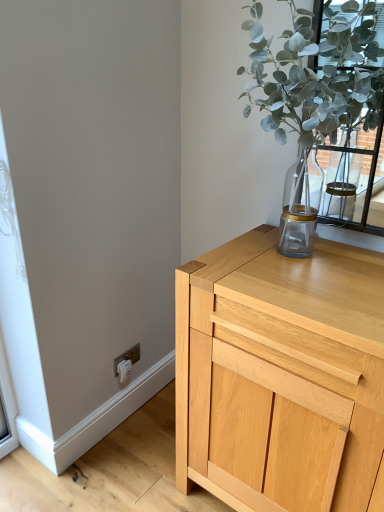
Question: Considering the relative sizes of white plastic electric outlet at lower left and light wood cabinet at upper right in the image provided, is white plastic electric outlet at lower left shorter than light wood cabinet at upper right?

Choices:
 (A) yes
 (B) no

Answer: (A)

Question: Can light wood cabinet at upper right be found inside white plastic electric outlet at lower left?

Choices:
 (A) yes
 (B) no

Answer: (B)

Question: From a real-world perspective, is white plastic electric outlet at lower left beneath light wood cabinet at upper right?

Choices:
 (A) no
 (B) yes

Answer: (B)

Question: Is white plastic electric outlet at lower left not close to light wood cabinet at upper right?

Choices:
 (A) yes
 (B) no

Answer: (B)

Question: Is white plastic electric outlet at lower left facing towards light wood cabinet at upper right?

Choices:
 (A) no
 (B) yes

Answer: (B)

Question: Is white plastic electric outlet at lower left behind light wood cabinet at upper right?

Choices:
 (A) no
 (B) yes

Answer: (B)

Question: Considering the relative sizes of green leafy plant at upper right and light wood cabinet at upper right in the image provided, is green leafy plant at upper right smaller than light wood cabinet at upper right?

Choices:
 (A) no
 (B) yes

Answer: (B)

Question: From the image's perspective, does green leafy plant at upper right appear lower than light wood cabinet at upper right?

Choices:
 (A) no
 (B) yes

Answer: (A)

Question: Is green leafy plant at upper right wider than light wood cabinet at upper right?

Choices:
 (A) yes
 (B) no

Answer: (B)

Question: Is green leafy plant at upper right surrounding light wood cabinet at upper right?

Choices:
 (A) yes
 (B) no

Answer: (B)

Question: Is green leafy plant at upper right to the left of light wood cabinet at upper right from the viewer's perspective?

Choices:
 (A) no
 (B) yes

Answer: (B)

Question: Does green leafy plant at upper right lie behind light wood cabinet at upper right?

Choices:
 (A) no
 (B) yes

Answer: (A)

Question: Can you confirm if green leafy plant at upper right is taller than white plastic electric outlet at lower left?

Choices:
 (A) yes
 (B) no

Answer: (A)